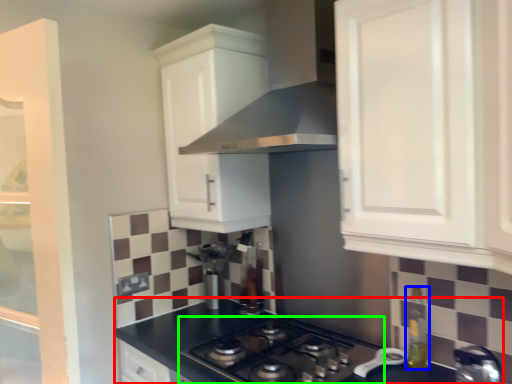
Question: Which is farther away from countertop (highlighted by a red box)? bottle (highlighted by a blue box) or gas stove (highlighted by a green box)?

Choices:
 (A) bottle
 (B) gas stove

Answer: (A)